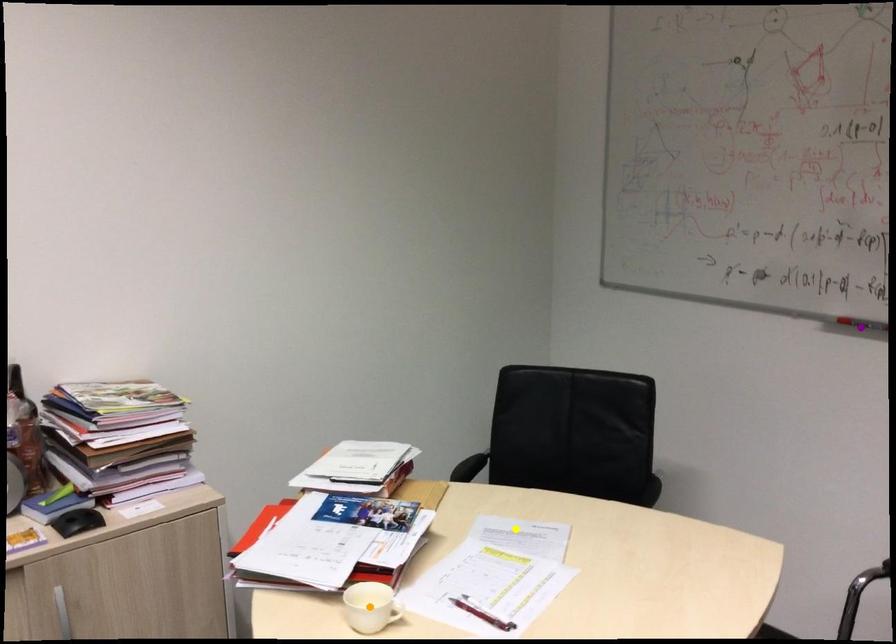
Order these from nearest to farthest:
orange point, yellow point, purple point

orange point
yellow point
purple point